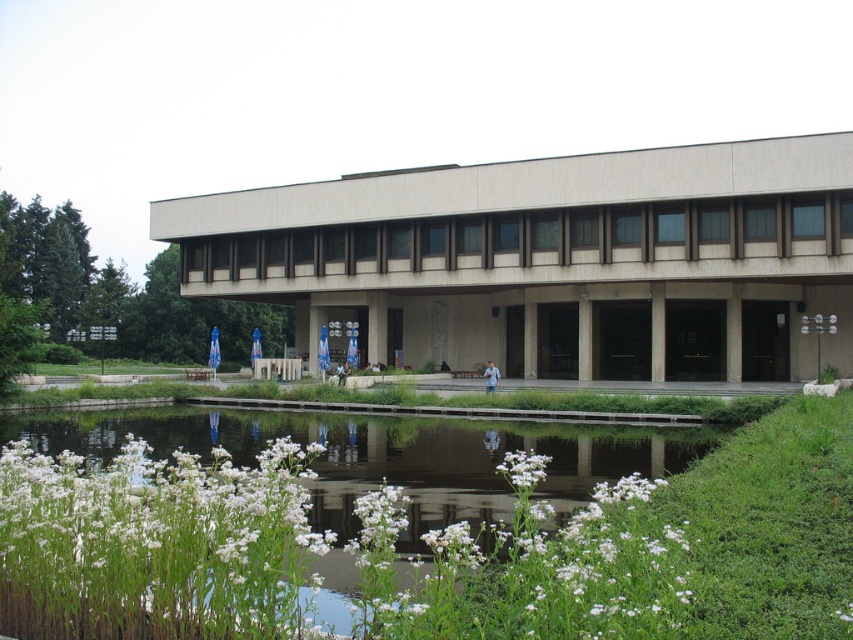
You are standing at the point marked by point (553, 259) in the image. What structure are you facing directly?

The point (553, 259) marks the beige concrete building at center, so you are facing the beige concrete building at center directly.